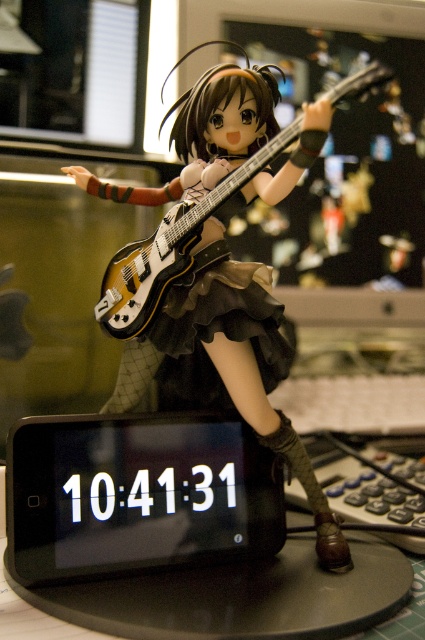
Question: Is matte black guitar at center to the left of matte yellow electric guitar at center from the viewer's perspective?

Choices:
 (A) no
 (B) yes

Answer: (A)

Question: Is matte black guitar at center positioned before matte yellow electric guitar at center?

Choices:
 (A) no
 (B) yes

Answer: (A)

Question: Considering the relative positions of matte black guitar at center and matte yellow electric guitar at center in the image provided, where is matte black guitar at center located with respect to matte yellow electric guitar at center?

Choices:
 (A) below
 (B) above

Answer: (A)

Question: Among these points, which one is farthest from the camera?

Choices:
 (A) (212, 92)
 (B) (118, 252)

Answer: (B)

Question: Which object appears farthest from the camera in this image?

Choices:
 (A) matte black guitar at center
 (B) matte yellow electric guitar at center

Answer: (A)

Question: Which object appears closest to the camera in this image?

Choices:
 (A) matte black guitar at center
 (B) matte yellow electric guitar at center

Answer: (B)